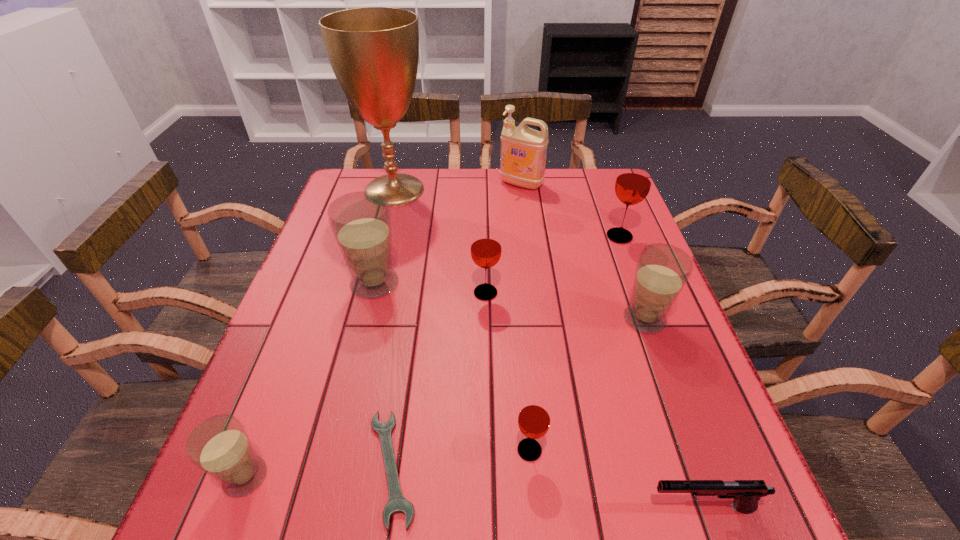
You are a GUI agent. You are given a task and a screenshot of the screen. Output one action in this format:
    pyautogui.click(x=<x>, y=<y>)
    Task: Click on the blank space located 0.060m on the left of the second smallest red glass
    The image size is (960, 540).
    Given the screenshot: What is the action you would take?
    pyautogui.click(x=446, y=293)

Where is `vacant region located on the back of the rightmost blue glass`? vacant region located on the back of the rightmost blue glass is located at coordinates (628, 274).

At what (x,y) coordinates should I click in order to perform the action: click on free space located 0.160m on the back of the smallest red glass. Please return your answer as a coordinate pair (x, y). The image size is (960, 540). Looking at the image, I should click on (522, 363).

This screenshot has height=540, width=960. I want to click on free spot located 0.330m on the right of the smallest blue glass, so click(465, 477).

What are the coordinates of `free spot located 0.070m at the aiming end of the ninth tallest object` in the screenshot? It's located at (603, 507).

The image size is (960, 540). What are the coordinates of `blank space located 0.260m at the aiming end of the ninth tallest object` in the screenshot? It's located at (485, 507).

What are the coordinates of `free region located at the aiming end of the ninth tallest object` in the screenshot? It's located at (516, 507).

The width and height of the screenshot is (960, 540). In order to click on vacant region located 0.070m on the right of the shortest object in this screenshot , I will do `click(461, 467)`.

This screenshot has height=540, width=960. Identify the location of trophy cup at the far edge. (374, 51).

I want to click on detergent at the far edge, so click(523, 150).